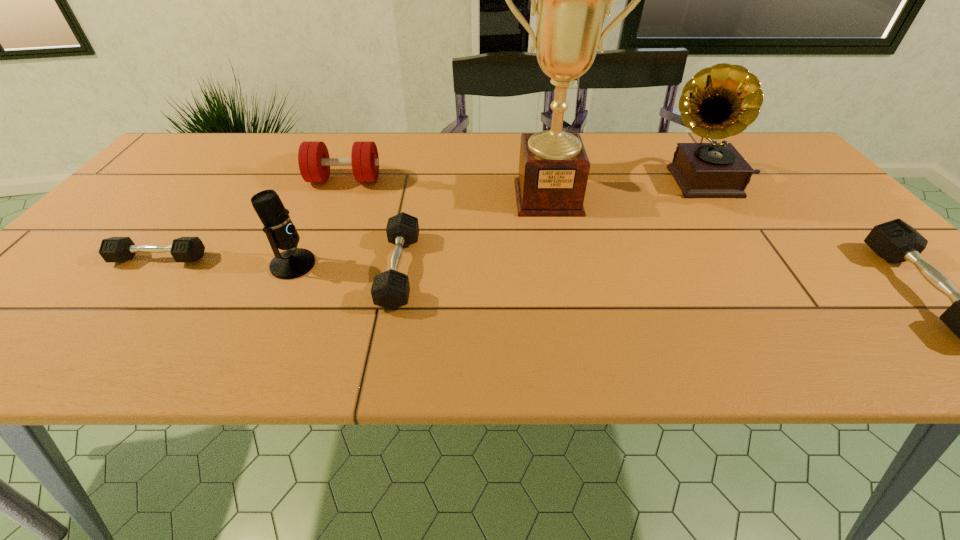
Identify the location of vacant area between the leftmost dumbbell and the farthest dumbbell. (252, 219).

Locate an element on the screen. Image resolution: width=960 pixels, height=540 pixels. free spot between the microphone and the second tallest object is located at coordinates [498, 223].

Identify the location of empty space that is in between the microphone and the third dumbbell from right to left. (319, 222).

This screenshot has width=960, height=540. What are the coordinates of `free space between the fifth shortest object and the tallest dumbbell` in the screenshot? It's located at (319, 222).

Point out which object is positioned as the fifth nearest to the sixth shortest object. Please provide its 2D coordinates. Your answer should be formatted as a tuple, i.e. [(x, y)], where the tuple contains the x and y coordinates of a point satisfying the conditions above.

[(294, 262)]

Locate an element on the screen. The width and height of the screenshot is (960, 540). the fourth closest object to the second tallest dumbbell is located at coordinates (314, 162).

Identify which dumbbell is located as the third nearest to the shortest object. Please provide its 2D coordinates. Your answer should be formatted as a tuple, i.e. [(x, y)], where the tuple contains the x and y coordinates of a point satisfying the conditions above.

[(895, 241)]

The width and height of the screenshot is (960, 540). In order to click on dumbbell that is the nearest to the fifth shortest object in this screenshot , I will do click(115, 249).

In order to click on free space that satisfies the following two spatial constraints: 1. on the front side of the microphone; 2. on the right side of the leftmost dumbbell in this screenshot , I will do `click(155, 265)`.

Identify the location of free region that satisfies the following two spatial constraints: 1. from the horn of the second tallest object; 2. on the plaque of the fifth object from left to right. [x=715, y=198].